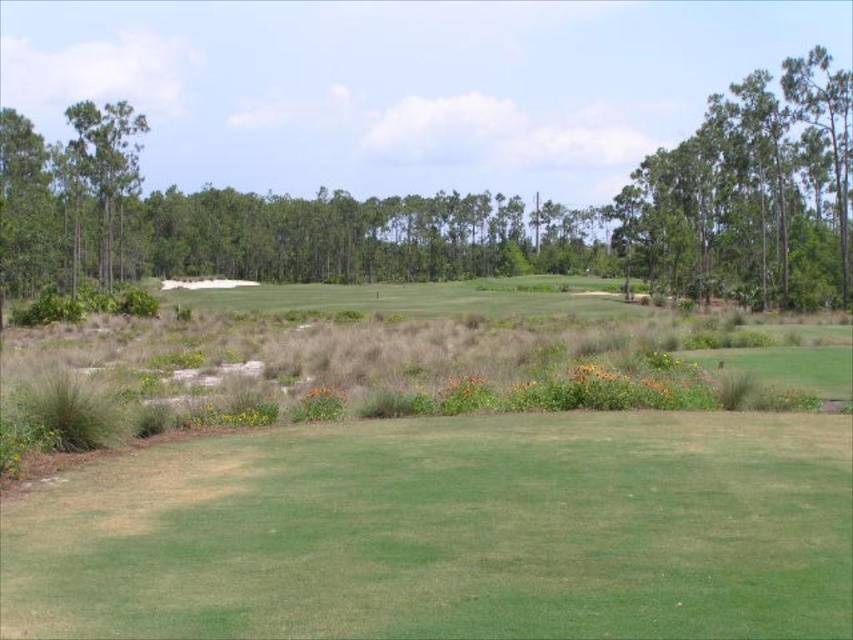
Question: Which point is farther to the camera?

Choices:
 (A) green grassy field at center
 (B) green leafy trees at upper right

Answer: (B)

Question: Observing the image, what is the correct spatial positioning of green leafy tree at upper center in reference to green leafy tree at left?

Choices:
 (A) below
 (B) above

Answer: (B)

Question: Estimate the real-world distances between objects in this image. Which object is closer to the green grassy field at center?

Choices:
 (A) green leafy trees at upper right
 (B) green leafy tree at upper center
 (C) green leafy tree at left

Answer: (A)

Question: Observing the image, what is the correct spatial positioning of green grassy field at center in reference to green leafy tree at left?

Choices:
 (A) left
 (B) right

Answer: (B)

Question: Which point is farther to the camera?

Choices:
 (A) green leafy tree at upper center
 (B) green leafy tree at left
 (C) green grassy field at center
 (D) green leafy trees at upper right

Answer: (B)

Question: Can you confirm if green leafy tree at upper center is positioned to the right of green leafy tree at left?

Choices:
 (A) yes
 (B) no

Answer: (A)